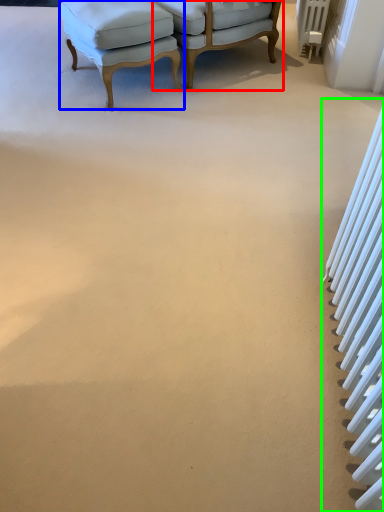
Question: Which object is positioned closest to chair (highlighted by a red box)? Select from chair (highlighted by a blue box) and radiator (highlighted by a green box).

Choices:
 (A) chair
 (B) radiator

Answer: (A)